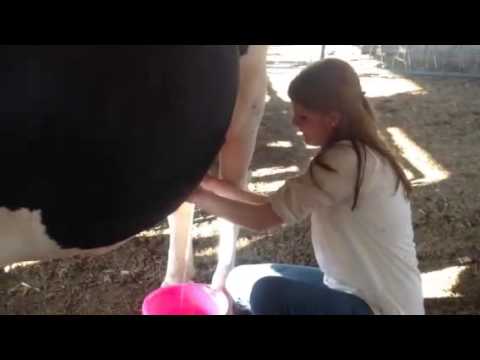
Image resolution: width=480 pixels, height=360 pixels. Find the location of `pink bucket`. pink bucket is located at coordinates (209, 298).